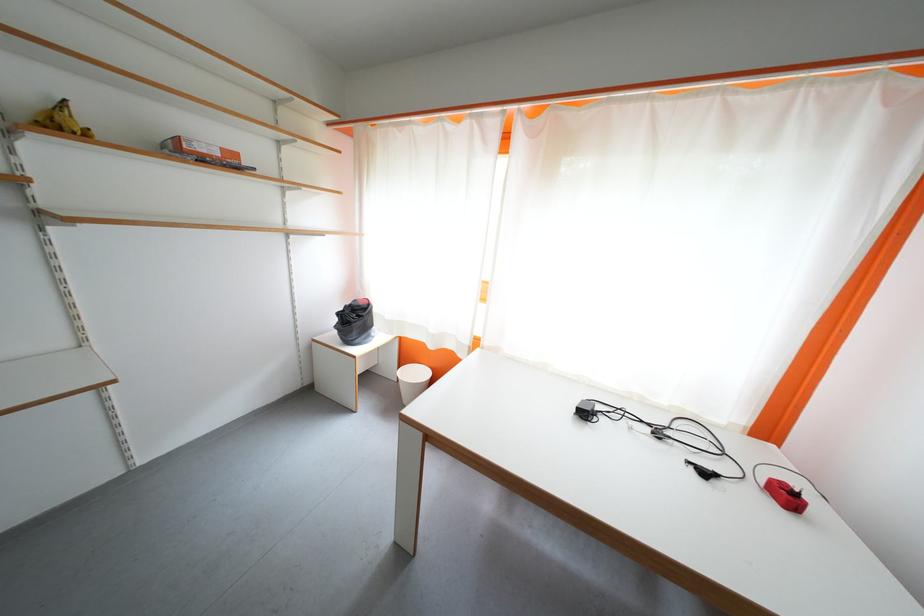
Which object does [355,322] point to?

It corresponds to the black bag in the image.